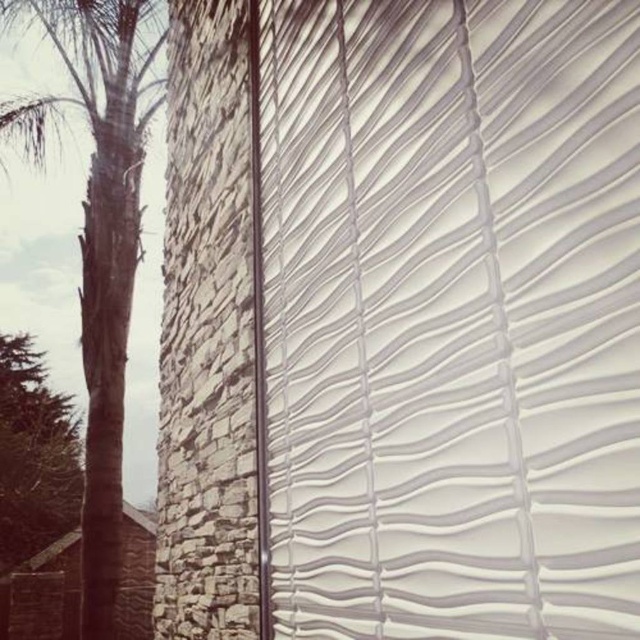
Question: Can you confirm if white textured blind at center is positioned to the left of green leafy tree at left?

Choices:
 (A) yes
 (B) no

Answer: (B)

Question: Which point is closer to the camera?

Choices:
 (A) white textured blind at center
 (B) brown textured palm tree at left

Answer: (A)

Question: Does white textured blind at center appear on the right side of brown textured palm tree at left?

Choices:
 (A) no
 (B) yes

Answer: (B)

Question: Is white textured blind at center wider than green leafy tree at left?

Choices:
 (A) no
 (B) yes

Answer: (A)

Question: Which object is positioned closest to the white textured blind at center?

Choices:
 (A) green leafy tree at left
 (B) brown textured palm tree at left

Answer: (B)

Question: Which object is closer to the camera taking this photo?

Choices:
 (A) brown textured palm tree at left
 (B) green leafy tree at left

Answer: (A)